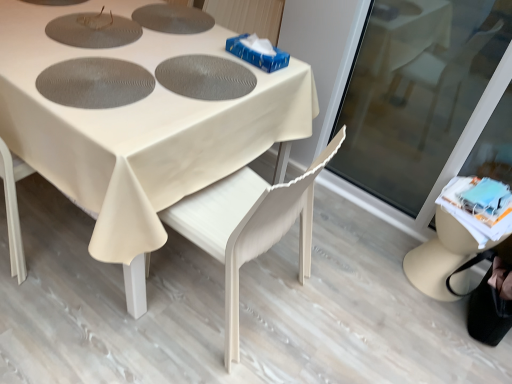
At what (x,y) coordinates should I click in order to perform the action: click on vacant location below transparent glass screen door at lower right (from a real-world perspective). Please return your answer as a coordinate pair (x, y). Looking at the image, I should click on (354, 198).